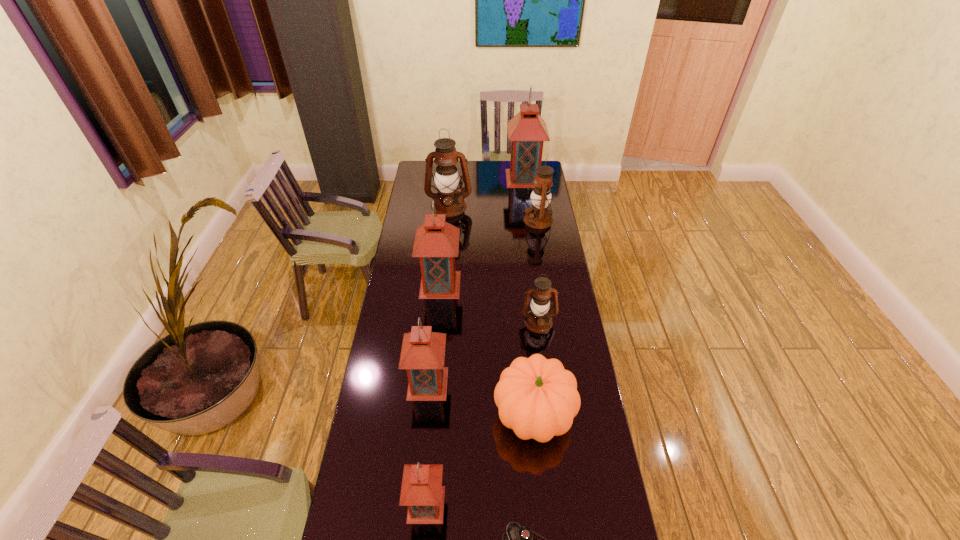
Locate an element on the screen. free spot located 0.340m on the side of the nearest brown lantern, there is a wick adjustment knob is located at coordinates (549, 409).

Where is `vacant space located on the right of the nearest lantern`? This screenshot has width=960, height=540. vacant space located on the right of the nearest lantern is located at coordinates (528, 504).

Locate an element on the screen. vacant space located 0.230m on the left of the pumpkin is located at coordinates (427, 415).

This screenshot has height=540, width=960. Find the location of `object present at the far edge`. object present at the far edge is located at coordinates (527, 131).

Locate an element on the screen. This screenshot has height=540, width=960. pumpkin that is at the right edge is located at coordinates (536, 397).

At what (x,y) coordinates should I click in order to perform the action: click on object situated at the far right corner. Please return your answer as a coordinate pair (x, y). This screenshot has width=960, height=540. Looking at the image, I should click on (527, 131).

Image resolution: width=960 pixels, height=540 pixels. Identify the location of vacant space at the left edge. (393, 287).

Image resolution: width=960 pixels, height=540 pixels. In the image, there is a desktop. In order to click on vacant space at the right edge in this screenshot , I will do `click(594, 455)`.

Find the location of a particular element. This screenshot has width=960, height=540. free spot at the far left corner of the desktop is located at coordinates tap(416, 161).

Find the location of `free space between the orange pumpkin and the fourth farthest lantern`. free space between the orange pumpkin and the fourth farthest lantern is located at coordinates (487, 350).